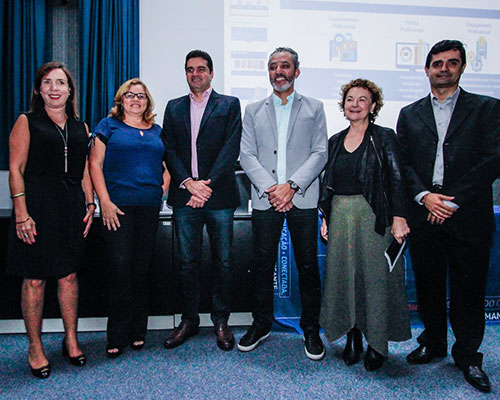
Identify the location of conference table. The image size is (500, 400). (241, 236).